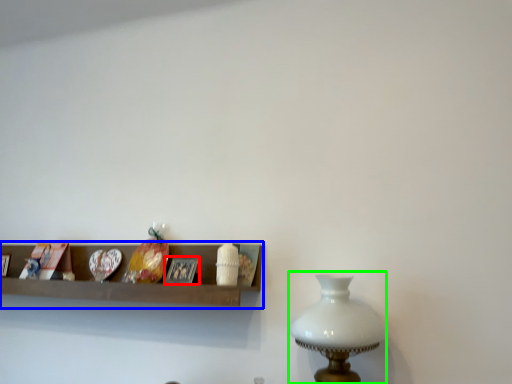
Question: Which is nearer to the picture frame (highlighted by a red box)? shelf (highlighted by a blue box) or table lamp (highlighted by a green box).

Choices:
 (A) shelf
 (B) table lamp

Answer: (A)